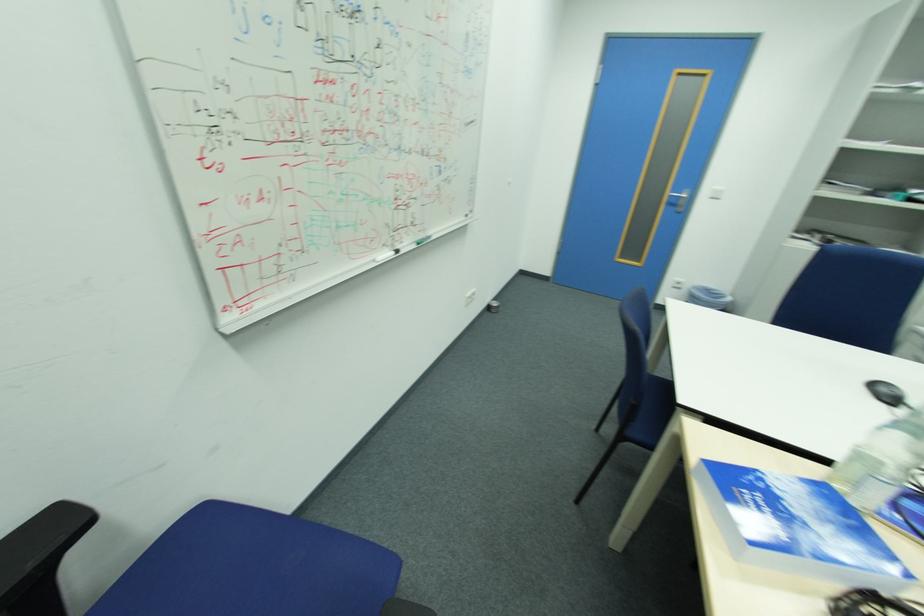
Describe the element at coordinates (678, 200) in the screenshot. I see `the silver door handle` at that location.